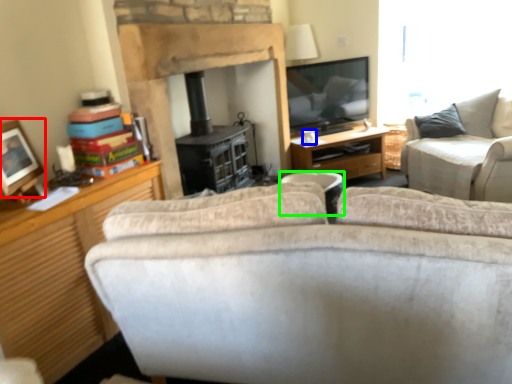
Question: Estimate the real-world distances between objects in this image. Which object is farther from picture frame (highlighted by a red box), coffee cup (highlighted by a blue box) or trash bin/can (highlighted by a green box)?

Choices:
 (A) coffee cup
 (B) trash bin/can

Answer: (A)